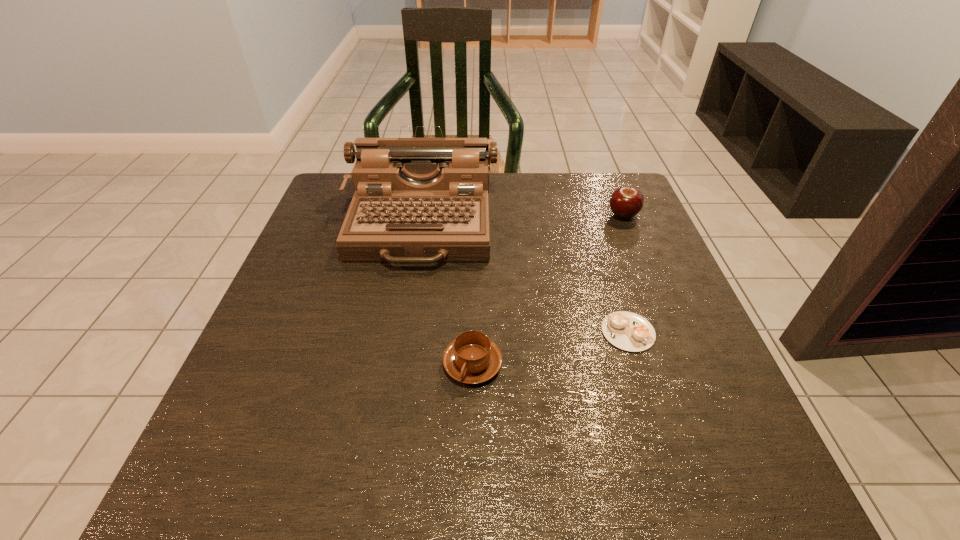
Where is `the tallest object`? the tallest object is located at coordinates (417, 200).

Where is `apple`? The image size is (960, 540). apple is located at coordinates (625, 202).

At what (x,y) coordinates should I click in order to perform the action: click on the taller cappuccino. Please return your answer as a coordinate pair (x, y). Looking at the image, I should click on (472, 358).

This screenshot has width=960, height=540. Find the location of `the second shortest object`. the second shortest object is located at coordinates (472, 358).

I want to click on the right cappuccino, so click(628, 331).

Locate an element on the screen. The width and height of the screenshot is (960, 540). the shortest object is located at coordinates (628, 331).

Find the location of a particular element. vacant position located 0.340m on the keyboard of the tallest object is located at coordinates (389, 414).

Locate an element on the screen. blank space located on the front of the second tallest object is located at coordinates (670, 330).

You are a GUI agent. You are given a task and a screenshot of the screen. Output one action in this format:
    pyautogui.click(x=<x>, y=<y>)
    Task: Click on the vacant area situated on the side of the second shortest object with the handle
    This screenshot has height=540, width=960.
    Given the screenshot: What is the action you would take?
    pyautogui.click(x=470, y=501)

Where is `free spot located on the left of the shorter cappuccino`? free spot located on the left of the shorter cappuccino is located at coordinates (560, 332).